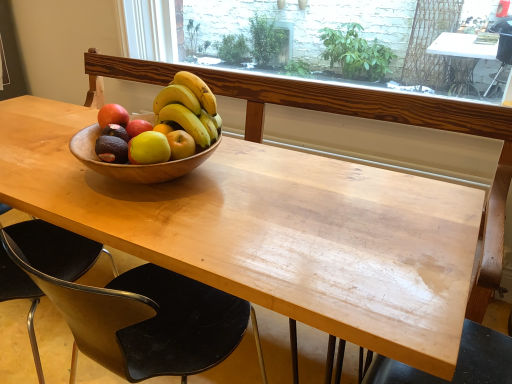
Question: In terms of size, does yellow matte bananas at center appear bigger or smaller than matte brown avocado at center?

Choices:
 (A) small
 (B) big

Answer: (B)

Question: Considering their positions, is yellow matte bananas at center located in front of or behind matte brown avocado at center?

Choices:
 (A) front
 (B) behind

Answer: (A)

Question: Which is nearer to the black plastic chair at lower left, the 2th chair viewed from the right?

Choices:
 (A) wooden table at center
 (B) matte brown avocado at center
 (C) yellow matte apple at center
 (D) yellow matte bananas at center
 (E) green matte grapefruit at center

Answer: (A)

Question: Which of these objects is positioned closest to the yellow matte apple at center?

Choices:
 (A) yellow matte bananas at center
 (B) green matte grapefruit at center
 (C) wooden table at center
 (D) matte brown avocado at center
 (E) black plastic chair at lower left, placed as the second chair when sorted from left to right

Answer: (D)